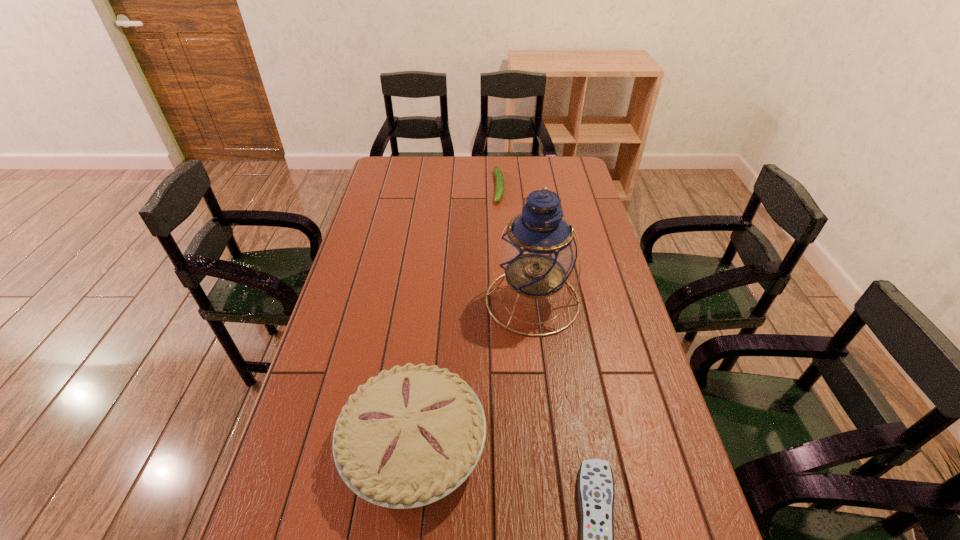
Identify the location of vacant space on the desktop that is between the pie and the remote control and is positioned on the front-facing side of the tallest object. The width and height of the screenshot is (960, 540). (526, 489).

Identify the location of free spot on the desktop that is between the pie and the shortest object and is positioned on the front-facing side of the farthest object. This screenshot has height=540, width=960. (506, 481).